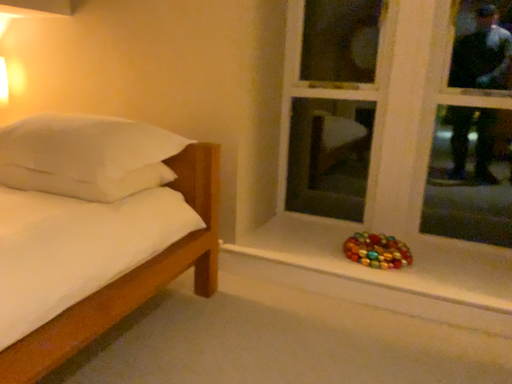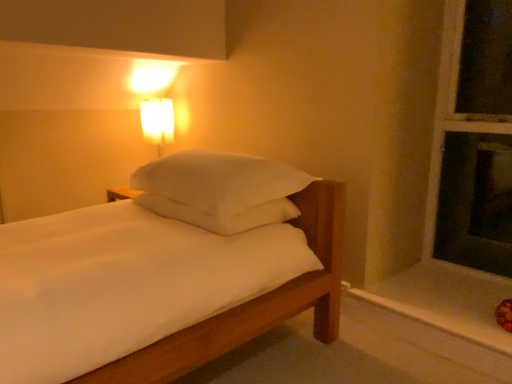
Question: Which way did the camera rotate in the video?

Choices:
 (A) rotated left
 (B) rotated right

Answer: (A)